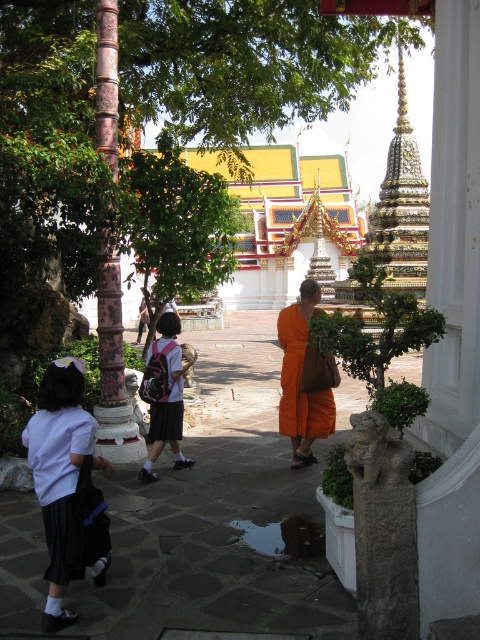
Question: Which is farther from the matte pink backpack at center?

Choices:
 (A) matte orange robe at center
 (B) white fabric skirt at lower left

Answer: (B)

Question: Which object is the closest to the orange cloth at center?

Choices:
 (A) matte orange robe at center
 (B) white fabric skirt at lower left
 (C) green leafy tree at center

Answer: (A)

Question: Does orange cloth at center appear over matte orange robe at center?

Choices:
 (A) no
 (B) yes

Answer: (B)

Question: Can you confirm if white fabric skirt at lower left is wider than orange cloth at center?

Choices:
 (A) no
 (B) yes

Answer: (B)

Question: Is the position of white fabric skirt at lower left less distant than that of matte pink backpack at center?

Choices:
 (A) yes
 (B) no

Answer: (A)

Question: Which point appears farthest from the camera in this image?

Choices:
 (A) (54, 449)
 (B) (156, 406)
 (C) (175, 186)
 (D) (302, 436)

Answer: (C)